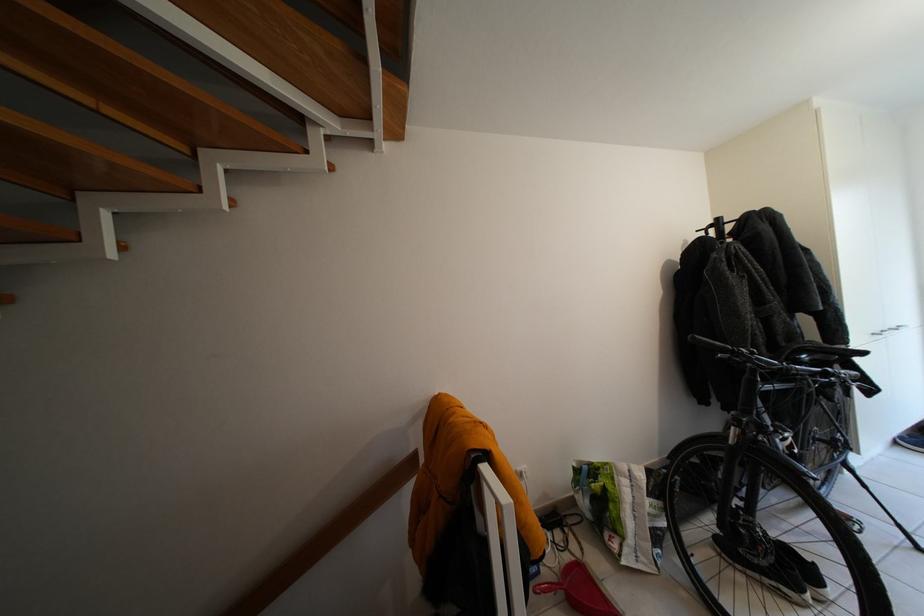
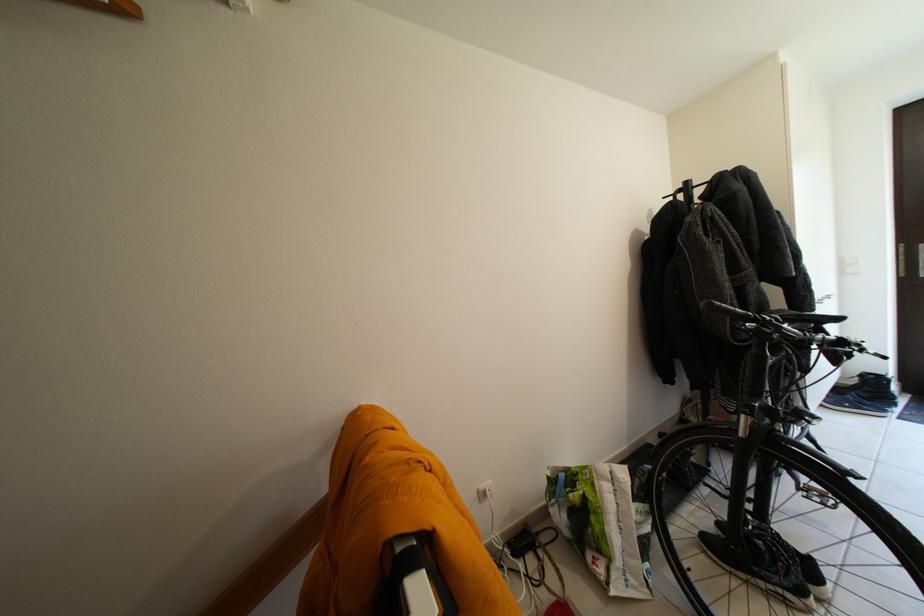
Find the pixel in the second image that matches point (543, 517) in the first image.

(512, 541)